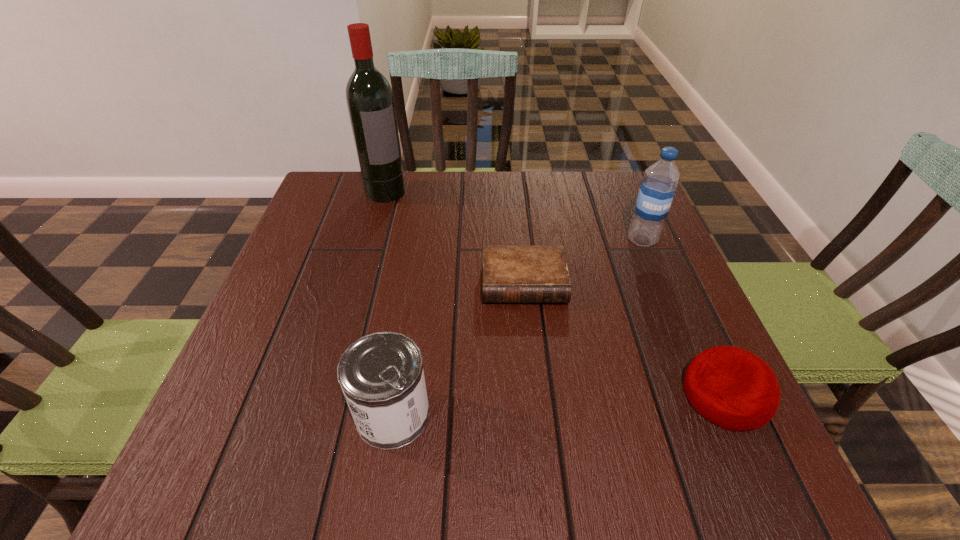
Where is `vacant region located 0.070m on the label of the water bottle`? The height and width of the screenshot is (540, 960). vacant region located 0.070m on the label of the water bottle is located at coordinates (625, 265).

Find the location of a particular element. The height and width of the screenshot is (540, 960). object that is positioned at the far edge is located at coordinates click(x=370, y=101).

Find the location of a particular element. can present at the near edge is located at coordinates (381, 375).

Image resolution: width=960 pixels, height=540 pixels. What are the coordinates of `beanbag that is at the near edge` in the screenshot? It's located at (733, 388).

You are a GUI agent. You are given a task and a screenshot of the screen. Output one action in this format:
    pyautogui.click(x=<x>, y=<y>)
    Task: Click on the object positioned at the left edge
    
    Given the screenshot: What is the action you would take?
    pyautogui.click(x=370, y=101)

The image size is (960, 540). What are the coordinates of `beanbag that is at the right edge` in the screenshot? It's located at (733, 388).

Locate an element on the screen. water bottle situated at the right edge is located at coordinates (657, 189).

Where is `object present at the far left corner`? The height and width of the screenshot is (540, 960). object present at the far left corner is located at coordinates (370, 101).

The height and width of the screenshot is (540, 960). I want to click on object that is at the near right corner, so click(x=733, y=388).

This screenshot has height=540, width=960. Identify the location of free space at the far edge. (461, 204).